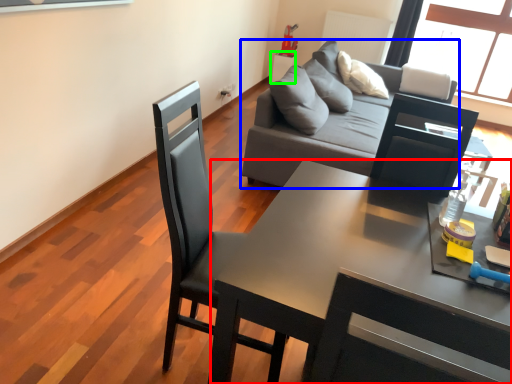
Question: Based on their relative distances, which object is nearer to desk (highlighted by a red box)? Choose from studio couch (highlighted by a blue box) and side table (highlighted by a green box).

Choices:
 (A) studio couch
 (B) side table

Answer: (A)